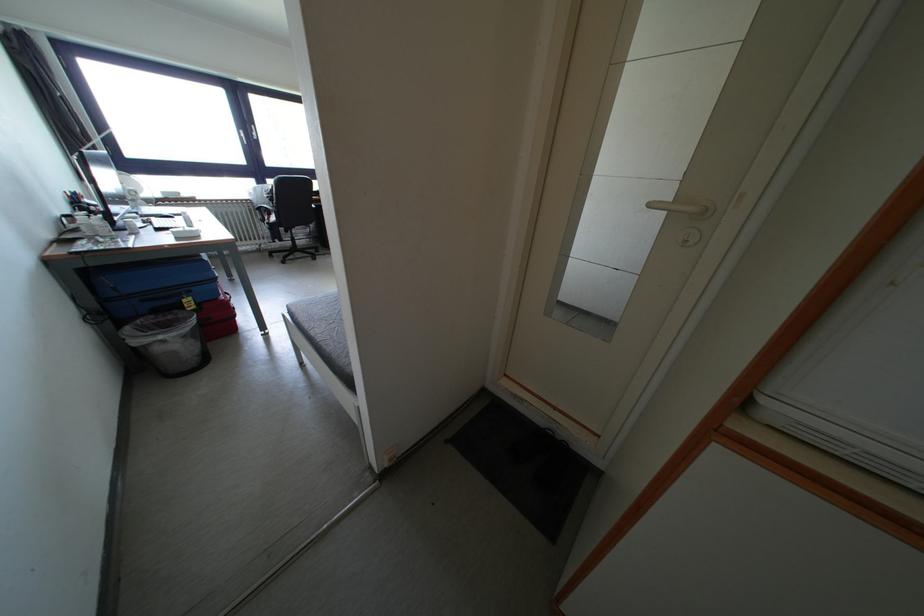
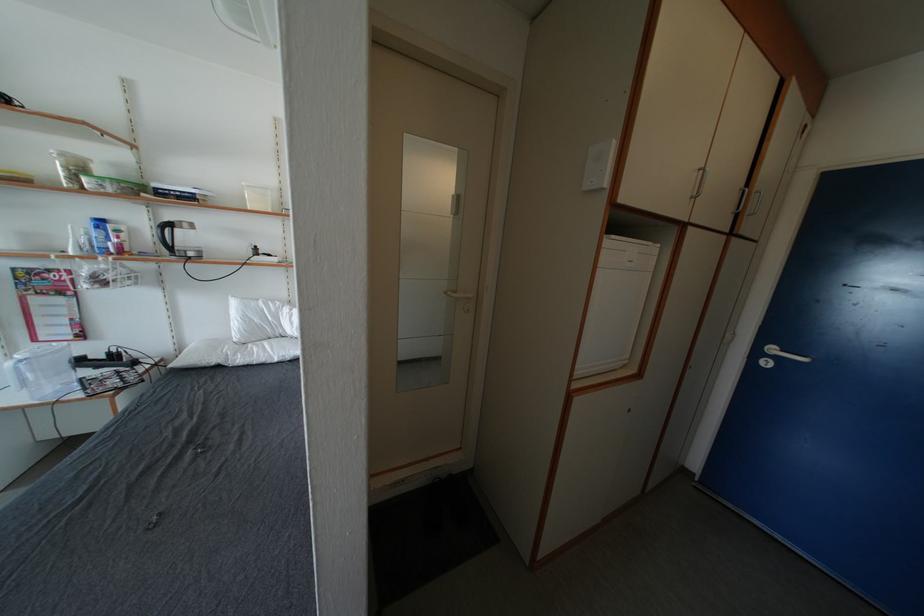
Question: The camera is either moving clockwise (left) or counter-clockwise (right) around the object. The first image is from the beginning of the video and the second image is from the end. Is the camera moving left or right when shooting the video?

Choices:
 (A) Left
 (B) Right

Answer: (A)